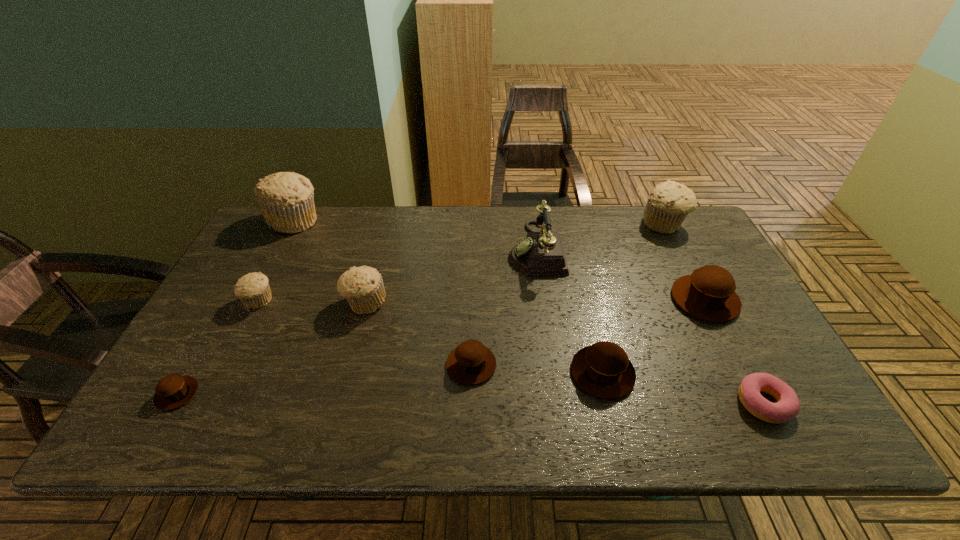
You are a GUI agent. You are given a task and a screenshot of the screen. Output one action in this format:
    pyautogui.click(x=<x>, y=<y>)
    Task: Click on the third brown muffin from left to right
    
    Given the screenshot: What is the action you would take?
    pyautogui.click(x=603, y=369)

The height and width of the screenshot is (540, 960). I want to click on the second shortest muffin, so click(x=471, y=363).

This screenshot has height=540, width=960. What are the coordinates of `the eighth tallest object` in the screenshot? It's located at (471, 363).

This screenshot has width=960, height=540. What are the coordinates of `the smallest brown muffin` in the screenshot? It's located at (173, 391).

The width and height of the screenshot is (960, 540). In order to click on the shortest muffin in this screenshot , I will do `click(173, 391)`.

Find the location of a particular element. pink doughnut is located at coordinates (787, 407).

This screenshot has width=960, height=540. I want to click on free point located 0.260m on the front of the tallest muffin, so click(255, 294).

Where is `vacant space situated 0.090m on the dial of the black telephone`? The width and height of the screenshot is (960, 540). vacant space situated 0.090m on the dial of the black telephone is located at coordinates click(x=478, y=249).

Image resolution: width=960 pixels, height=540 pixels. In order to click on vacant region located 0.170m on the dial of the black telephone in this screenshot , I will do [452, 249].

At what (x,y) coordinates should I click in order to perform the action: click on free space located 0.110m on the dial of the black telephone. Please return your answer as a coordinate pair (x, y). This screenshot has height=540, width=960. Looking at the image, I should click on (471, 249).